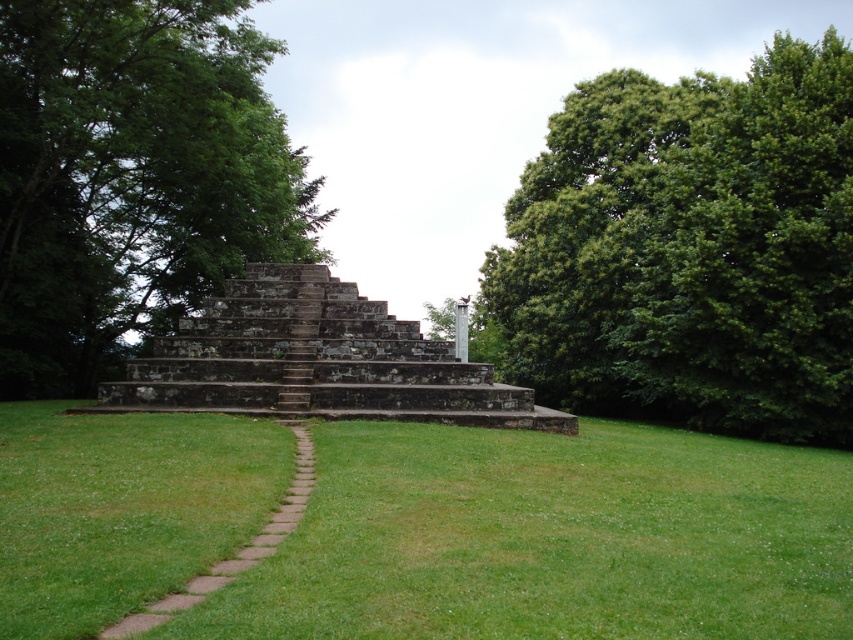
Question: Does green grass at center appear over brown stone path at center?

Choices:
 (A) no
 (B) yes

Answer: (A)

Question: Among these objects, which one is farthest from the camera?

Choices:
 (A) green grass at center
 (B) brown stone path at center
 (C) green leafy tree at center
 (D) green leafy tree at upper right

Answer: (C)

Question: Is green leafy tree at center further to camera compared to rusty stone stairs at center?

Choices:
 (A) no
 (B) yes

Answer: (B)

Question: Which point appears farthest from the camera in this image?

Choices:
 (A) (403, 330)
 (B) (792, 205)

Answer: (B)

Question: Which of the following is the closest to the observer?

Choices:
 (A) (567, 374)
 (B) (305, 456)
 (C) (505, 520)

Answer: (C)

Question: Does green leafy tree at center have a larger size compared to rusty stone stairs at center?

Choices:
 (A) yes
 (B) no

Answer: (A)